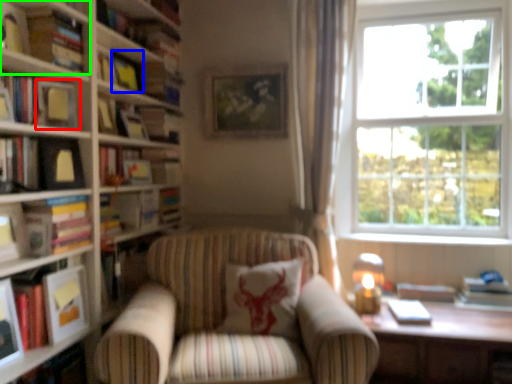
Question: Considering the real-world distances, which object is farthest from picture frame (highlighted by a red box)? picture frame (highlighted by a blue box) or book (highlighted by a green box)?

Choices:
 (A) picture frame
 (B) book

Answer: (A)